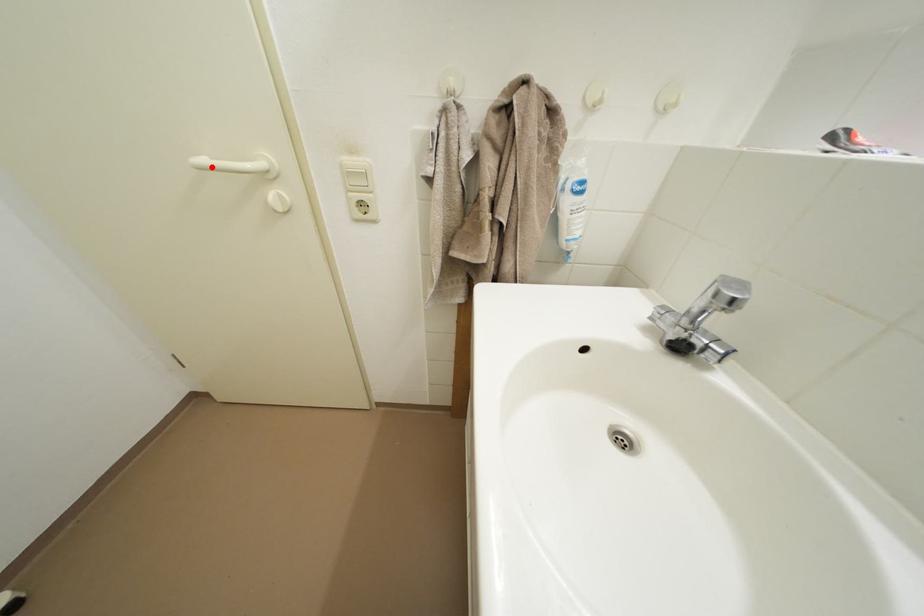
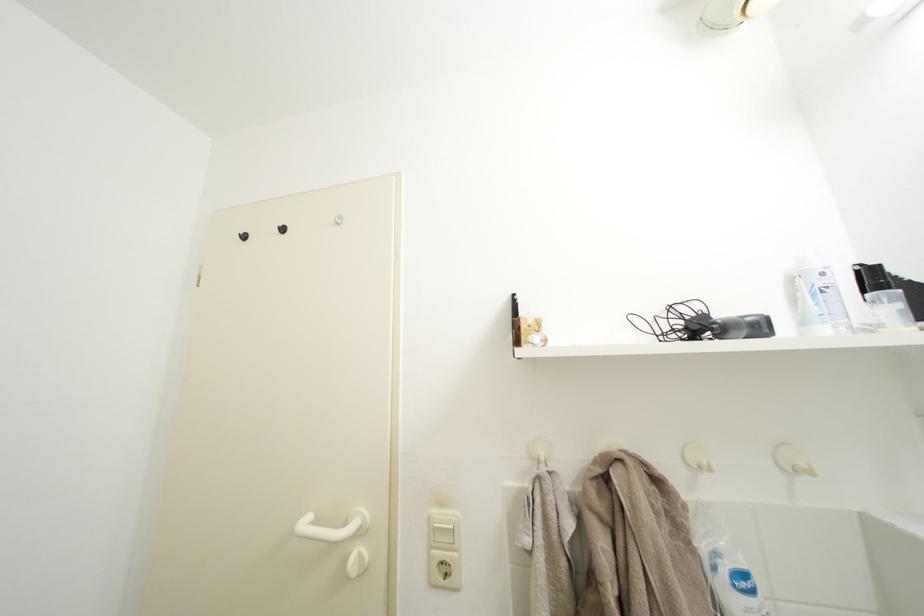
Locate, in the second image, the point that corresponds to the highlighted location in the first image.

(314, 528)